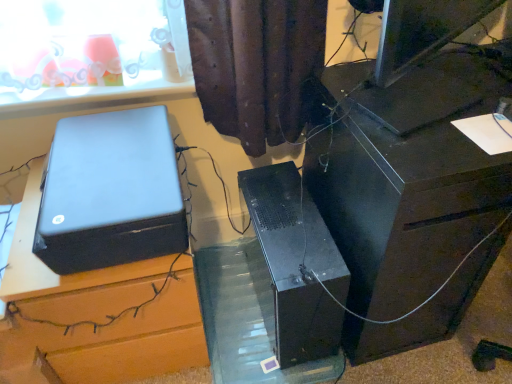
In order to click on vacant area on top of black matte computer tower at center (from a real-world perspective) in this screenshot , I will do `click(295, 224)`.